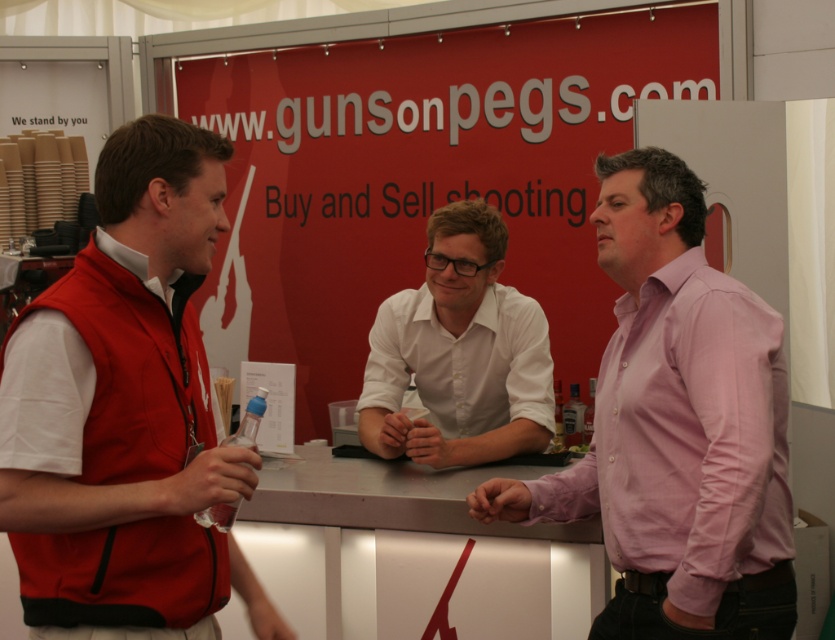
You are a photographer at the trade show. You want to take a photo of the white glossy shirt at center and the smooth skin hand at center. Which object will appear larger in the photo?

The white glossy shirt at center will appear larger in the photo because it is closer to the viewer than the smooth skin hand at center.